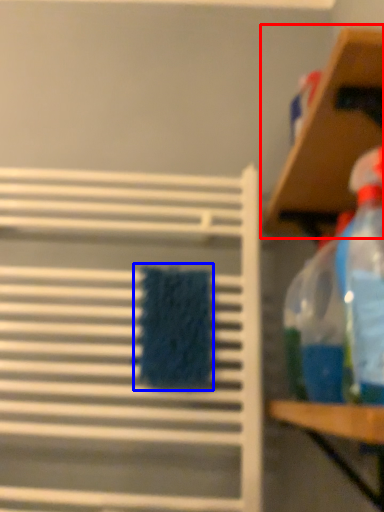
Question: Which object appears closest to the camera in this image, shelf (highlighted by a red box) or beach towel (highlighted by a blue box)?

Choices:
 (A) shelf
 (B) beach towel

Answer: (A)